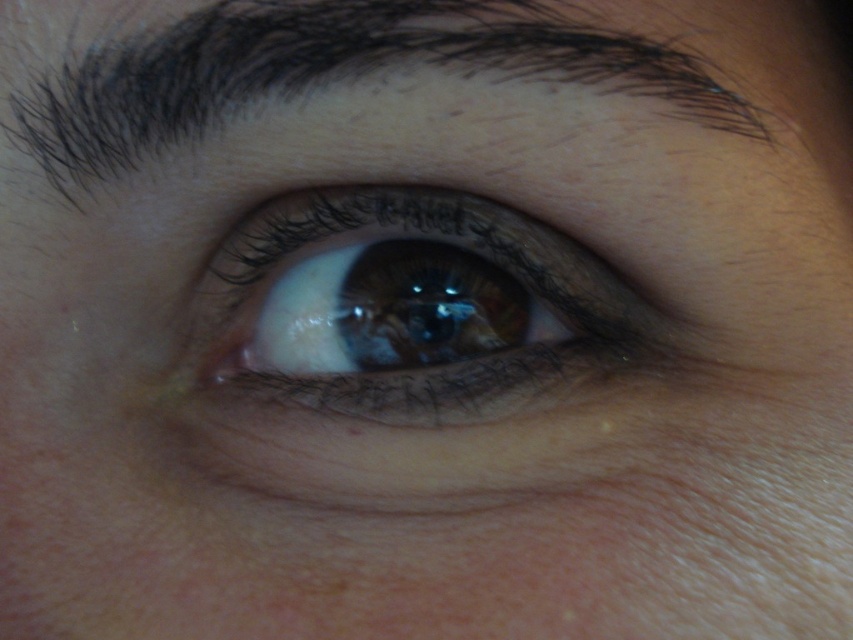
Measure the distance between brown matte eye at center and dark brown hair at upper center.

A: They are 2.51 inches apart.

Is brown matte eye at center taller than dark brown hair at upper center?

Yes.

Image resolution: width=853 pixels, height=640 pixels. What do you see at coordinates (415, 316) in the screenshot?
I see `brown matte eye at center` at bounding box center [415, 316].

This screenshot has height=640, width=853. Find the location of `brown matte eye at center`. brown matte eye at center is located at coordinates tap(415, 316).